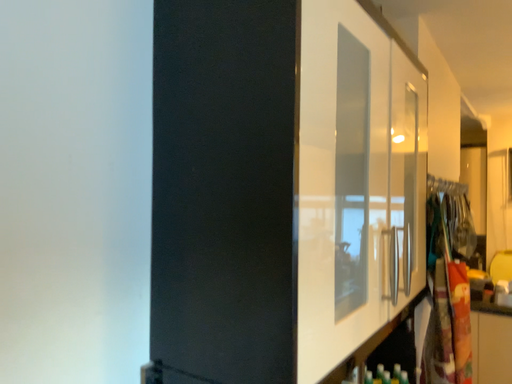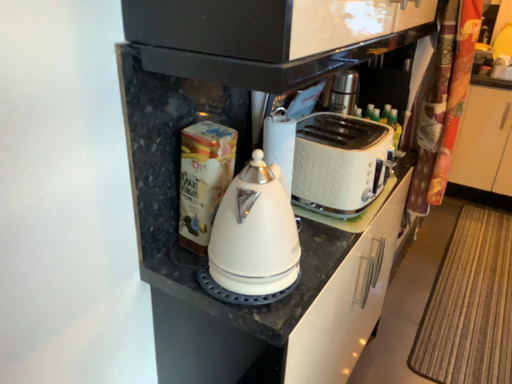
Question: Which way did the camera rotate in the video?

Choices:
 (A) rotated upward
 (B) rotated downward

Answer: (B)